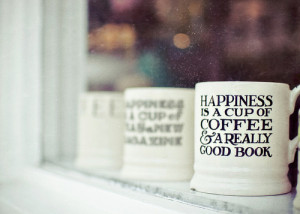
Locate an element on the screen. decorative & symbol is located at coordinates (209, 137).